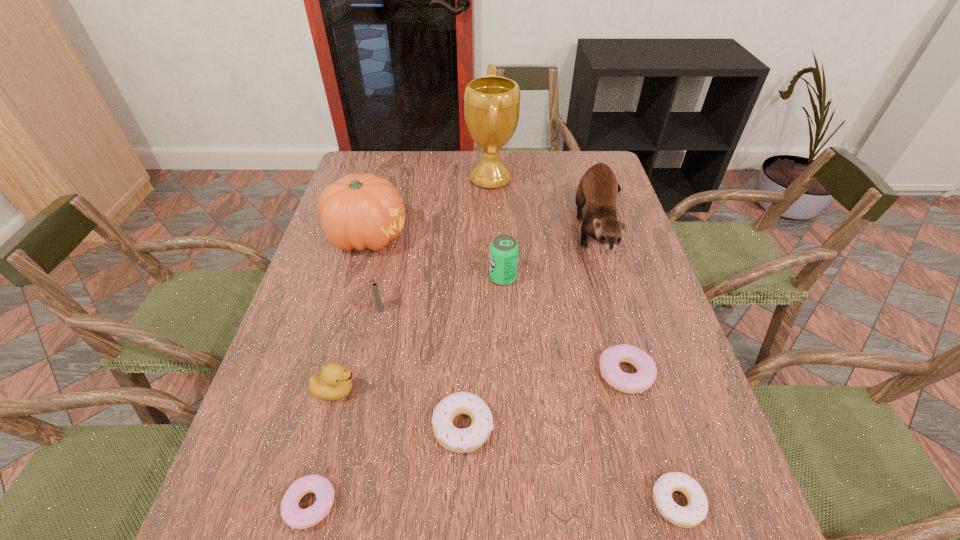
I want to click on object that can be found as the fifth closest to the igniter, so [x=297, y=518].

Select which object appears as the second closest to the bigger white doughnut. Please provide its 2D coordinates. Your answer should be formatted as a tuple, i.e. [(x, y)], where the tuple contains the x and y coordinates of a point satisfying the conditions above.

[(334, 382)]

Locate an element on the screen. This screenshot has width=960, height=540. doughnut object that ranks as the second closest to the pop soda is located at coordinates (456, 440).

Locate an element on the screen. doughnut object that ranks as the third closest to the igniter is located at coordinates (609, 360).

I want to click on vacant space that satisfies the following two spatial constraints: 1. on the front-facing side of the seventh shortest object; 2. on the front side of the igniter, so click(x=504, y=309).

Locate an element on the screen. vacant space that satisfies the following two spatial constraints: 1. on the back side of the farthest doughnut; 2. on the carved face of the pumpkin is located at coordinates (588, 237).

Find the location of `vacant position in the image that satisfies the following two spatial constraints: 1. at the face of the brown ferret; 2. on the front-facing side of the pop soda`. vacant position in the image that satisfies the following two spatial constraints: 1. at the face of the brown ferret; 2. on the front-facing side of the pop soda is located at coordinates (619, 278).

I want to click on free space that satisfies the following two spatial constraints: 1. at the face of the brown ferret; 2. on the front-facing side of the pop soda, so click(x=619, y=278).

The height and width of the screenshot is (540, 960). I want to click on vacant space that satisfies the following two spatial constraints: 1. on the front side of the right pink doughnut; 2. on the left side of the igniter, so click(366, 374).

Where is `free space that satisfies the following two spatial constraints: 1. on the carved face of the pumpkin; 2. on the back side of the left pink doughnut`? Image resolution: width=960 pixels, height=540 pixels. free space that satisfies the following two spatial constraints: 1. on the carved face of the pumpkin; 2. on the back side of the left pink doughnut is located at coordinates (293, 504).